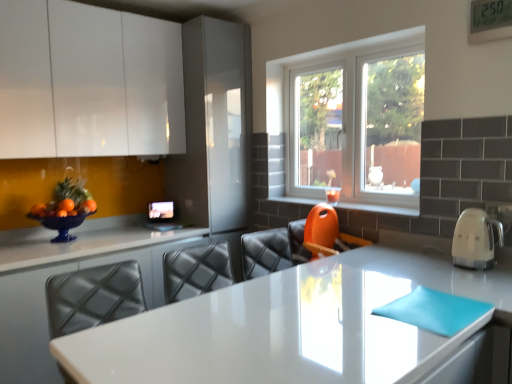
Question: Is white glossy countertop at center, which is the 2th countertop in left-to-right order, not within clear glass window at center?

Choices:
 (A) yes
 (B) no

Answer: (A)

Question: From a real-world perspective, is white glossy countertop at center, the second countertop when ordered from back to front, positioned over clear glass window at center based on gravity?

Choices:
 (A) yes
 (B) no

Answer: (B)

Question: Would you say clear glass window at center is part of white glossy countertop at center, which ranks as the first countertop in front-to-back order,'s contents?

Choices:
 (A) no
 (B) yes

Answer: (A)

Question: Is white glossy countertop at center, which is the 2th countertop in left-to-right order, facing away from clear glass window at center?

Choices:
 (A) no
 (B) yes

Answer: (A)

Question: From the image's perspective, is white glossy countertop at center, the second countertop when ordered from back to front, located above clear glass window at center?

Choices:
 (A) no
 (B) yes

Answer: (A)

Question: Is white glossy countertop at center, the second countertop when ordered from back to front, beside clear glass window at center?

Choices:
 (A) yes
 (B) no

Answer: (B)

Question: Does clear glass window at center have a greater height compared to orange plastic chair at lower center?

Choices:
 (A) no
 (B) yes

Answer: (B)

Question: From a real-world perspective, is clear glass window at center positioned over orange plastic chair at lower center based on gravity?

Choices:
 (A) no
 (B) yes

Answer: (B)

Question: From a real-world perspective, is clear glass window at center located beneath orange plastic chair at lower center?

Choices:
 (A) yes
 (B) no

Answer: (B)

Question: Is clear glass window at center turned away from orange plastic chair at lower center?

Choices:
 (A) no
 (B) yes

Answer: (A)

Question: Considering the relative sizes of clear glass window at center and orange plastic chair at lower center in the image provided, is clear glass window at center smaller than orange plastic chair at lower center?

Choices:
 (A) no
 (B) yes

Answer: (A)

Question: From the image's perspective, is clear glass window at center on top of orange plastic chair at lower center?

Choices:
 (A) yes
 (B) no

Answer: (A)

Question: From a real-world perspective, is white glossy countertop at center, the second countertop when ordered from front to back, below white glossy countertop at center, which is the 2th countertop in left-to-right order?

Choices:
 (A) yes
 (B) no

Answer: (A)